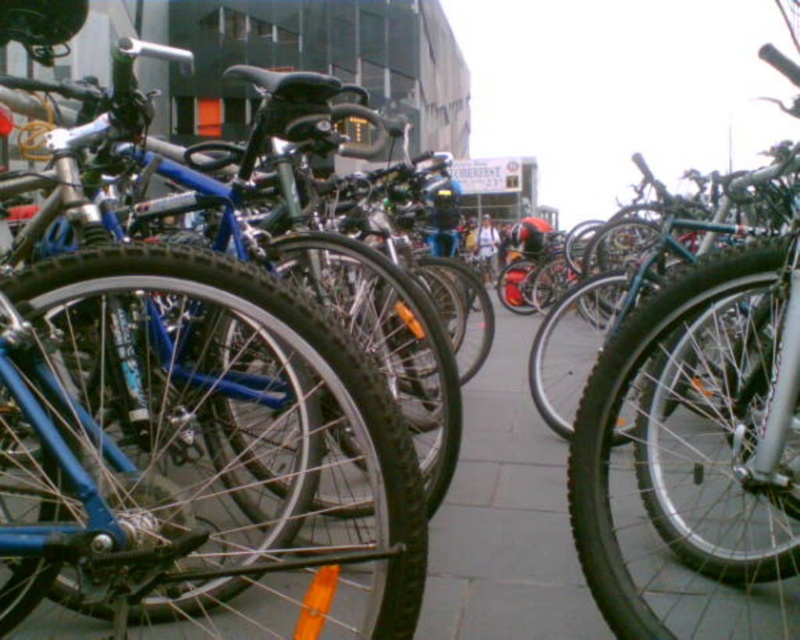
You are standing at the origin point of the coordinate system. You want to reach the blue matte bicycle at left. Which direction should you move in the coordinate system to get there?

You should move towards the positive x and positive y direction in the coordinate system to reach the blue matte bicycle at left, since its coordinates are at point 0.664 in the x axis and 0.247 in the y axis.

You are a delivery person who needs to move a package from the blue matte bicycle at left to the gray concrete pavement at center. Can you place the package directly between them without moving either object?

The blue matte bicycle at left is positioned on the left side of gray concrete pavement at center, so you can place the package directly between them as there is space between the two objects.